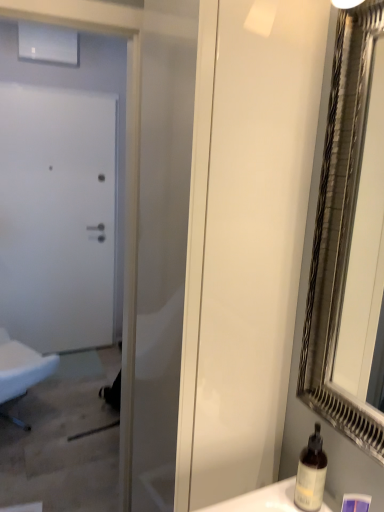
What is the approximate width of translucent glass bottle at lower right?

The width of translucent glass bottle at lower right is 2.99 inches.

Identify the location of white fabric chair at left. Image resolution: width=384 pixels, height=512 pixels. (21, 367).

This screenshot has height=512, width=384. What do you see at coordinates (21, 367) in the screenshot?
I see `white fabric chair at left` at bounding box center [21, 367].

Identify the location of white glossy screen door at center. (245, 238).

This screenshot has width=384, height=512. Identify the location of white matte door at left. (84, 90).

Find the location of a particular element. This screenshot has height=512, width=384. furniture below the white glossy screen door at center (from the image's perspective) is located at coordinates (21, 367).

Is the surface of white glossy screen door at center in direct contact with white fabric chair at left?

No, white glossy screen door at center is not next to white fabric chair at left.

From the image's perspective, is white glossy screen door at center positioned above or below white fabric chair at left?

white glossy screen door at center is above white fabric chair at left.

Considering the relative sizes of white glossy screen door at center and white fabric chair at left in the image provided, is white glossy screen door at center taller than white fabric chair at left?

Yes, white glossy screen door at center is taller than white fabric chair at left.

Looking at this image, from a real-world perspective, relative to white fabric chair at left, is white matte door at left vertically above or below?

In terms of real-world spatial position, white matte door at left is above white fabric chair at left.

Between white matte door at left and white fabric chair at left, which one has larger size?

With larger size is white fabric chair at left.

Would you say white matte door at left is outside white fabric chair at left?

white matte door at left is positioned outside white fabric chair at left.

Identify the location of furniture to the left of white matte door at left. (21, 367).

From the image's perspective, is translucent glass bottle at lower right under white matte door at left?

Correct, translucent glass bottle at lower right appears lower than white matte door at left in the image.

Can you confirm if translucent glass bottle at lower right is wider than white matte door at left?

Correct, the width of translucent glass bottle at lower right exceeds that of white matte door at left.

Image resolution: width=384 pixels, height=512 pixels. I want to click on door located on the left of translucent glass bottle at lower right, so click(84, 90).

Locate an element on the screen. The width and height of the screenshot is (384, 512). door behind the white glossy screen door at center is located at coordinates (84, 90).

Does point (217, 464) come farther from viewer compared to point (62, 71)?

No, it is not.

From the picture: Would you say white glossy screen door at center is outside white matte door at left?

That's correct, white glossy screen door at center is outside of white matte door at left.

In terms of height, does white glossy screen door at center look taller or shorter compared to white matte door at left?

In the image, white glossy screen door at center appears to be shorter than white matte door at left.

From the image's perspective, which object appears higher, white glossy screen door at center or translucent glass bottle at lower right?

white glossy screen door at center, from the image's perspective.

Considering the relative sizes of white glossy screen door at center and translucent glass bottle at lower right in the image provided, is white glossy screen door at center shorter than translucent glass bottle at lower right?

No.

From a real-world perspective, is white glossy screen door at center positioned under translucent glass bottle at lower right based on gravity?

Incorrect, from a real-world perspective, white glossy screen door at center is higher than translucent glass bottle at lower right.

How distant is white glossy screen door at center from translucent glass bottle at lower right?

The distance of white glossy screen door at center from translucent glass bottle at lower right is 17.64 inches.

From a real-world perspective, is translucent glass bottle at lower right located beneath white glossy screen door at center?

Yes, from a real-world perspective, translucent glass bottle at lower right is below white glossy screen door at center.

Is translucent glass bottle at lower right smaller than white glossy screen door at center?

Yes.

Is translucent glass bottle at lower right oriented towards white glossy screen door at center?

No, translucent glass bottle at lower right is not turned towards white glossy screen door at center.

Based on the photo, in the image, is translucent glass bottle at lower right positioned in front of or behind white glossy screen door at center?

Clearly, translucent glass bottle at lower right is behind white glossy screen door at center.

Consider the image. What's the angular difference between white fabric chair at left and white glossy screen door at center's facing directions?

168 degrees separate the facing orientations of white fabric chair at left and white glossy screen door at center.

From their relative heights in the image, would you say white fabric chair at left is taller or shorter than white glossy screen door at center?

white fabric chair at left is shorter than white glossy screen door at center.

Between white fabric chair at left and white glossy screen door at center, which one is positioned in front?

Positioned in front is white glossy screen door at center.

How far apart are white fabric chair at left and white glossy screen door at center?

A distance of 1.89 meters exists between white fabric chair at left and white glossy screen door at center.

Find the location of `furniture on the left of white glossy screen door at center`. furniture on the left of white glossy screen door at center is located at coordinates 21,367.

This screenshot has width=384, height=512. Identify the location of door above the white fabric chair at left (from a real-world perspective). (84, 90).

Estimate the real-world distances between objects in this image. Which object is closer to white glossy screen door at center, translucent glass bottle at lower right or white fabric chair at left?

The object closer to white glossy screen door at center is translucent glass bottle at lower right.

Estimate the real-world distances between objects in this image. Which object is further from white matte door at left, translucent glass bottle at lower right or white fabric chair at left?

translucent glass bottle at lower right is further to white matte door at left.

Considering their positions, is white glossy screen door at center positioned closer to white fabric chair at left than white matte door at left?

The object closer to white fabric chair at left is white matte door at left.

Based on the photo, which object lies further to the anchor point translucent glass bottle at lower right, white matte door at left or white glossy screen door at center?

white matte door at left.

From the image, which object appears to be nearer to white matte door at left, white glossy screen door at center or white fabric chair at left?

Based on the image, white fabric chair at left appears to be nearer to white matte door at left.

Considering their positions, is translucent glass bottle at lower right positioned further to white fabric chair at left than white glossy screen door at center?

translucent glass bottle at lower right is positioned further to the anchor white fabric chair at left.

From the image, which object appears to be nearer to white matte door at left, white fabric chair at left or white glossy screen door at center?

white fabric chair at left lies closer to white matte door at left than the other object.

Which object lies further to the anchor point translucent glass bottle at lower right, white matte door at left or white fabric chair at left?

white matte door at left lies further to translucent glass bottle at lower right than the other object.

Find the location of a particular element. The height and width of the screenshot is (512, 384). bottle between white glossy screen door at center and white fabric chair at left along the z-axis is located at coordinates (311, 474).

The height and width of the screenshot is (512, 384). I want to click on bottle between white glossy screen door at center and white matte door at left in the front-back direction, so click(311, 474).

This screenshot has width=384, height=512. In order to click on furniture between translucent glass bottle at lower right and white matte door at left along the z-axis in this screenshot , I will do `click(21, 367)`.

You are a GUI agent. You are given a task and a screenshot of the screen. Output one action in this format:
    pyautogui.click(x=<x>, y=<y>)
    Task: Click on the furniture between white glossy screen door at center and white matte door at left along the z-axis
    This screenshot has height=512, width=384.
    Given the screenshot: What is the action you would take?
    pyautogui.click(x=21, y=367)